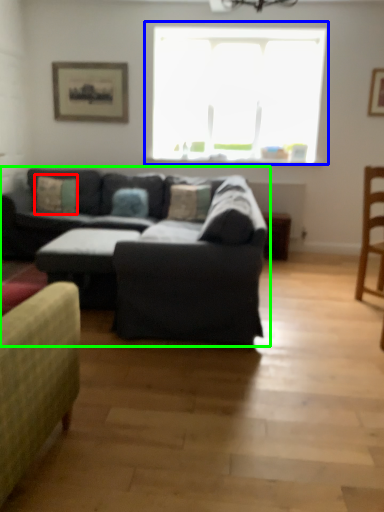
Question: Based on their relative distances, which object is nearer to pillow (highlighted by a red box)? Choose from window (highlighted by a blue box) and studio couch (highlighted by a green box).

Choices:
 (A) window
 (B) studio couch

Answer: (B)